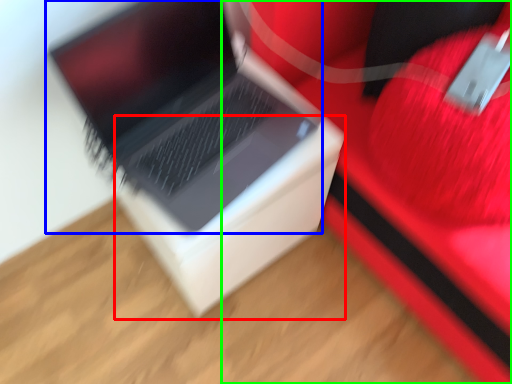
Question: Estimate the real-world distances between objects in this image. Which object is closer to cardboard box (highlighted by a red box), laptop (highlighted by a blue box) or furniture (highlighted by a green box)?

Choices:
 (A) laptop
 (B) furniture

Answer: (A)